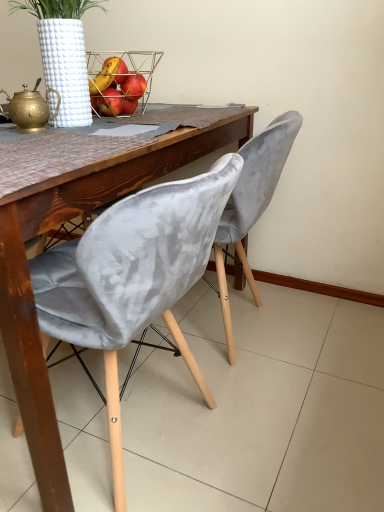
The height and width of the screenshot is (512, 384). In order to click on free space above velvet grey chair at center, which ranks as the 1th chair in front-to-back order (from a real-world perspective) in this screenshot , I will do `click(78, 152)`.